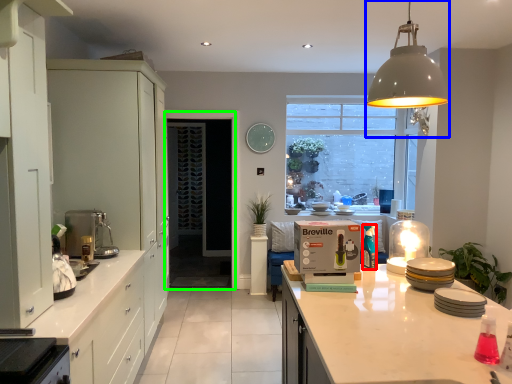
Question: Considering the real-world distances, which object is farthest from bottle (highlighted by a red box)? light fixture (highlighted by a blue box) or screen door (highlighted by a green box)?

Choices:
 (A) light fixture
 (B) screen door

Answer: (B)